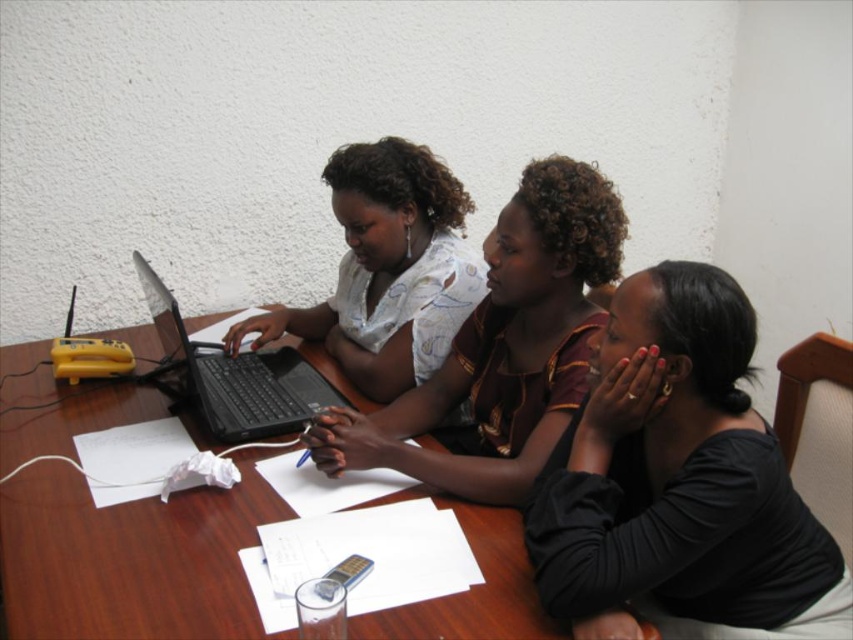
Can you confirm if black matte shirt at lower right is thinner than matte white blouse at center?

Indeed, black matte shirt at lower right has a lesser width compared to matte white blouse at center.

Between point (581, 477) and point (508, 426), which one is positioned behind?

The point (508, 426) is behind.

At what (x,y) coordinates should I click in order to perform the action: click on black matte shirt at lower right. Please return your answer as a coordinate pair (x, y). Image resolution: width=853 pixels, height=640 pixels. Looking at the image, I should click on tap(677, 481).

Can you confirm if black matte shirt at lower right is smaller than matte white shirt at center?

Indeed, black matte shirt at lower right has a smaller size compared to matte white shirt at center.

Is point (643, 570) less distant than point (402, 193)?

That is True.

Find the location of a particular element. This screenshot has width=853, height=640. black matte shirt at lower right is located at coordinates (677, 481).

Does matte white blouse at center come in front of black plastic laptop at left?

Yes, it is in front of black plastic laptop at left.

The width and height of the screenshot is (853, 640). I want to click on matte white blouse at center, so click(x=503, y=348).

Where is `matte white blouse at center`? The image size is (853, 640). matte white blouse at center is located at coordinates (503, 348).